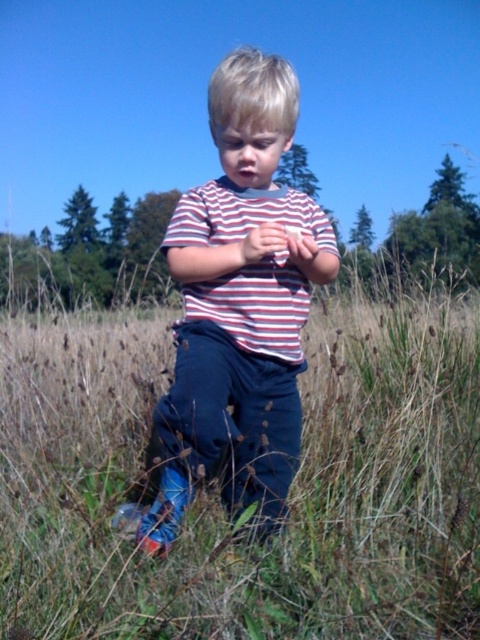
Question: Which point is farther to the camera?

Choices:
 (A) (109, 582)
 (B) (211, 376)

Answer: (B)

Question: Is blue jeans at center bigger than striped fabric shirt at center?

Choices:
 (A) no
 (B) yes

Answer: (B)

Question: Is blue jeans at center positioned in front of striped fabric shirt at center?

Choices:
 (A) yes
 (B) no

Answer: (A)

Question: Can you confirm if blue jeans at center is positioned to the right of striped fabric shirt at center?

Choices:
 (A) no
 (B) yes

Answer: (B)